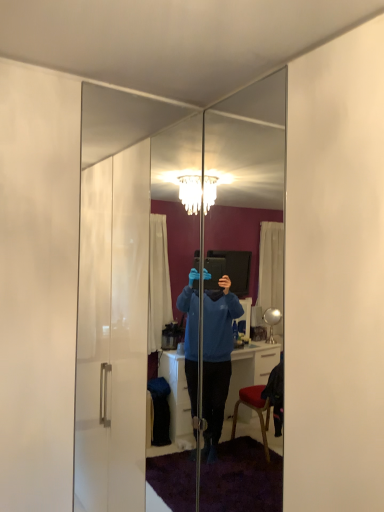
Question: Considering the positions of point (147, 231) and point (223, 132), is point (147, 231) closer or farther from the camera than point (223, 132)?

Choices:
 (A) closer
 (B) farther

Answer: (B)

Question: From the image's perspective, relative to clear glass mirror at center, arranged as the second mirror when viewed from the left, is clear glass mirror at center, the 1th mirror in the left-to-right sequence, above or below?

Choices:
 (A) below
 (B) above

Answer: (B)

Question: Is clear glass mirror at center, the second mirror in the right-to-left sequence, inside or outside of clear glass mirror at center, the first mirror viewed from the right?

Choices:
 (A) outside
 (B) inside

Answer: (A)

Question: From the image's perspective, is clear glass mirror at center, the first mirror viewed from the right, located above or below clear glass mirror at center, the 1th mirror in the left-to-right sequence?

Choices:
 (A) below
 (B) above

Answer: (A)

Question: Is clear glass mirror at center, arranged as the second mirror when viewed from the left, wider or thinner than clear glass mirror at center, the 1th mirror in the left-to-right sequence?

Choices:
 (A) thin
 (B) wide

Answer: (B)

Question: Is clear glass mirror at center, arranged as the second mirror when viewed from the left, bigger or smaller than clear glass mirror at center, the second mirror in the right-to-left sequence?

Choices:
 (A) small
 (B) big

Answer: (B)

Question: Considering the positions of point (226, 142) and point (236, 201), is point (226, 142) closer or farther from the camera than point (236, 201)?

Choices:
 (A) farther
 (B) closer

Answer: (B)